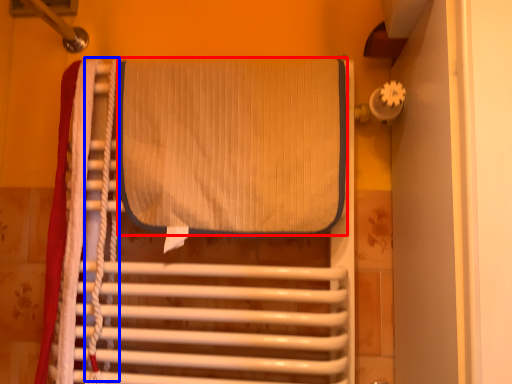
Question: Which of the following is the farthest to the observer, wide (highlighted by a red box) or rope (highlighted by a blue box)?

Choices:
 (A) wide
 (B) rope

Answer: (B)